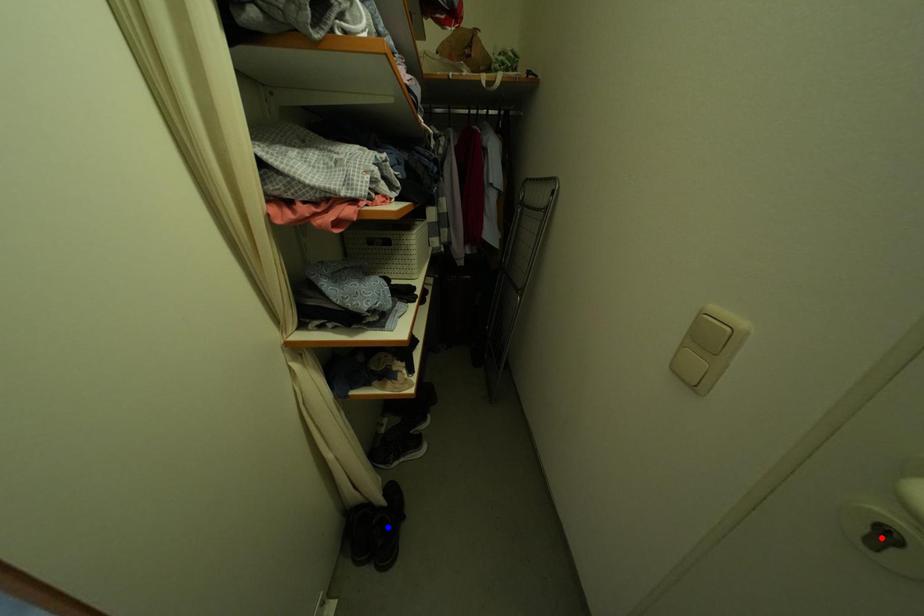
Question: Which of the two points in the image is closer to the camera?

Choices:
 (A) Blue point is closer.
 (B) Red point is closer.

Answer: (B)